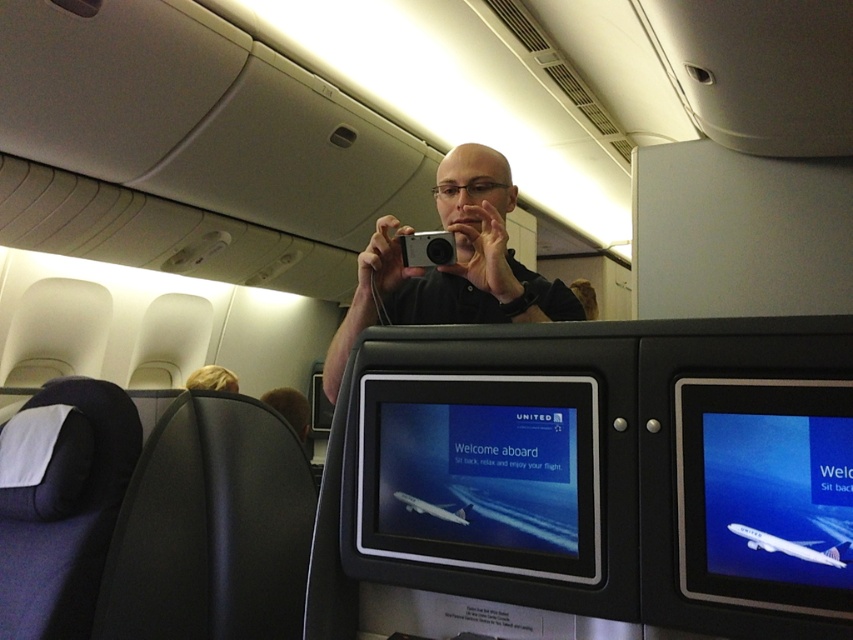
Looking at this image, you are a passenger sitting in the aisle seat of an airplane. You notice the blue glossy screen at center and the black matte camera at center. Which object is closer to you?

The blue glossy screen at center is closer to you because it is in front of the black matte camera at center.

You are a flight attendant checking the cabin. You see the blue glossy screen at center and the silver metallic camera at center. Which object is wider?

The blue glossy screen at center is wider than the silver metallic camera at center.

You are a flight attendant standing at the camera position. You need to hand out a snack to a passenger seated at point (x=575, y=484). Can you reach the passenger without moving from your current position?

The distance of point (x=575, y=484) from the camera is 36.86 inches. Since the average human arm length is about 25 inches, you cannot reach the passenger at point (x=575, y=484) without moving.